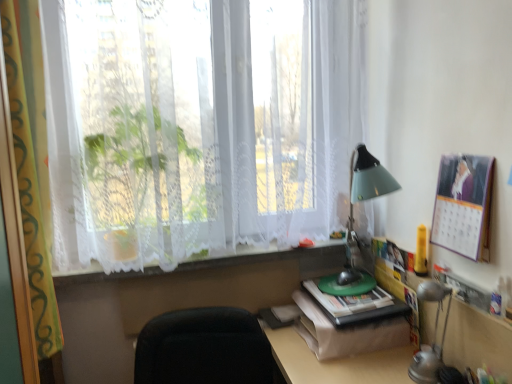
This screenshot has width=512, height=384. What are the coordinates of `free spot above green matte book at bottom right (from a real-world perspective)` in the screenshot? It's located at (357, 294).